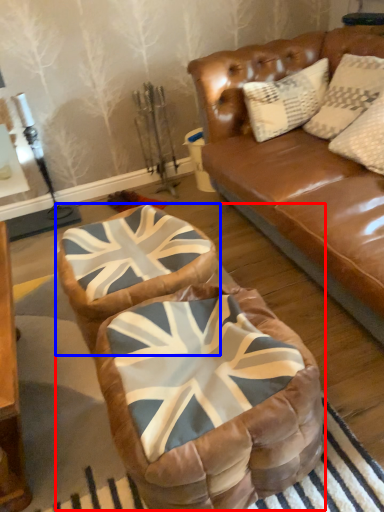
Question: Which object is closer to the camera taking this photo, bean bag chair (highlighted by a red box) or swivel chair (highlighted by a blue box)?

Choices:
 (A) bean bag chair
 (B) swivel chair

Answer: (A)